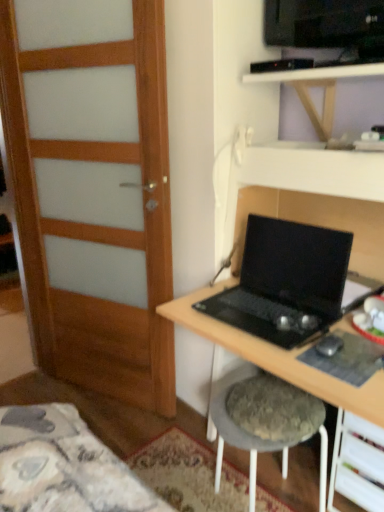
You are a GUI agent. You are given a task and a screenshot of the screen. Output one action in this format:
    pyautogui.click(x=<x>, y=<y>)
    Task: Click on the vacant space in front of wooden door at left
    The height and width of the screenshot is (512, 384).
    Given the screenshot: What is the action you would take?
    pyautogui.click(x=116, y=431)